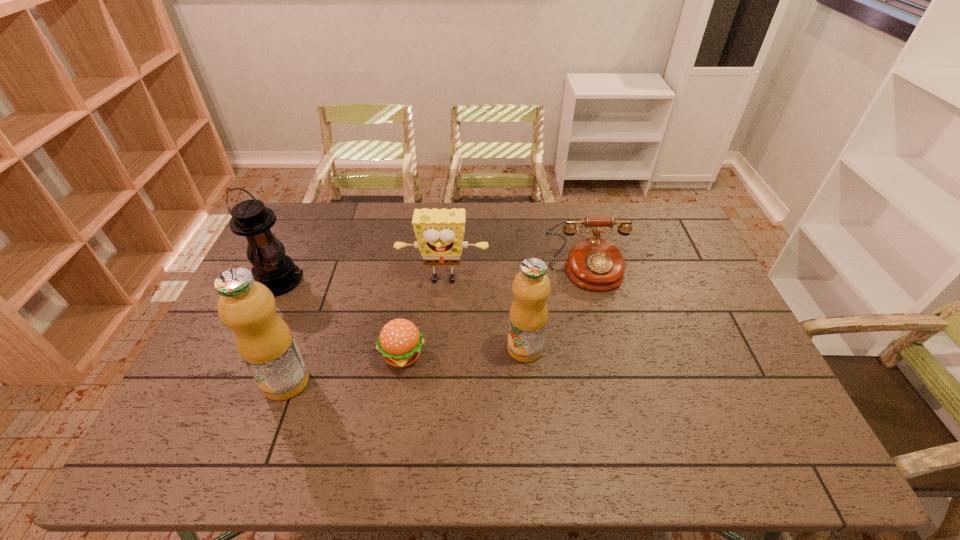
The height and width of the screenshot is (540, 960). I want to click on the taller fruit juice, so click(x=263, y=339).

Where is `the second object from right to left`? Image resolution: width=960 pixels, height=540 pixels. the second object from right to left is located at coordinates 531,287.

Image resolution: width=960 pixels, height=540 pixels. What are the coordinates of `the shorter fruit juice` in the screenshot? It's located at 531,287.

Image resolution: width=960 pixels, height=540 pixels. Find the location of `the third shortest object`. the third shortest object is located at coordinates (439, 232).

Locate an element on the screen. The image size is (960, 540). lantern is located at coordinates (250, 218).

Image resolution: width=960 pixels, height=540 pixels. Identify the location of telephone. (596, 264).

Where is `the fifth tallest object`? This screenshot has width=960, height=540. the fifth tallest object is located at coordinates (596, 264).

I want to click on hamburger, so click(x=400, y=341).

Locate an element on the screen. This screenshot has width=960, height=540. vacant space located on the front label of the second object from right to left is located at coordinates (530, 410).

The height and width of the screenshot is (540, 960). I want to click on free space located 0.130m on the front-facing side of the third shortest object, so click(x=440, y=325).